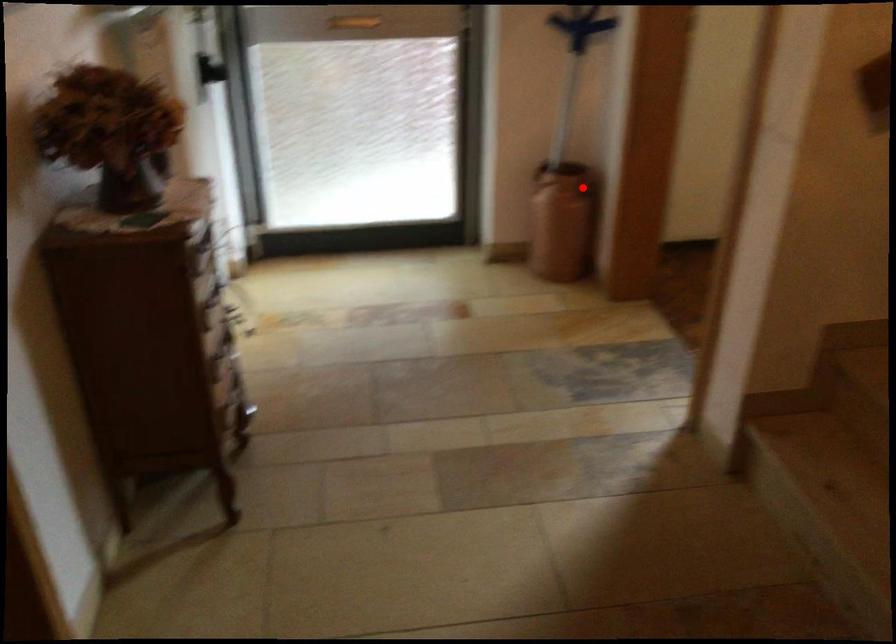
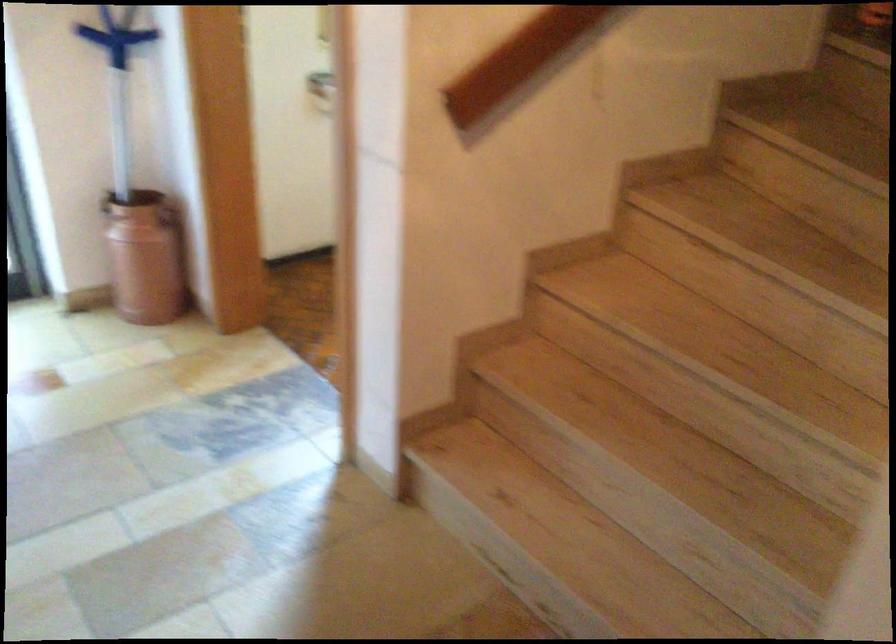
Find the pixel in the second image that matches the highlighted location in the first image.

(168, 216)